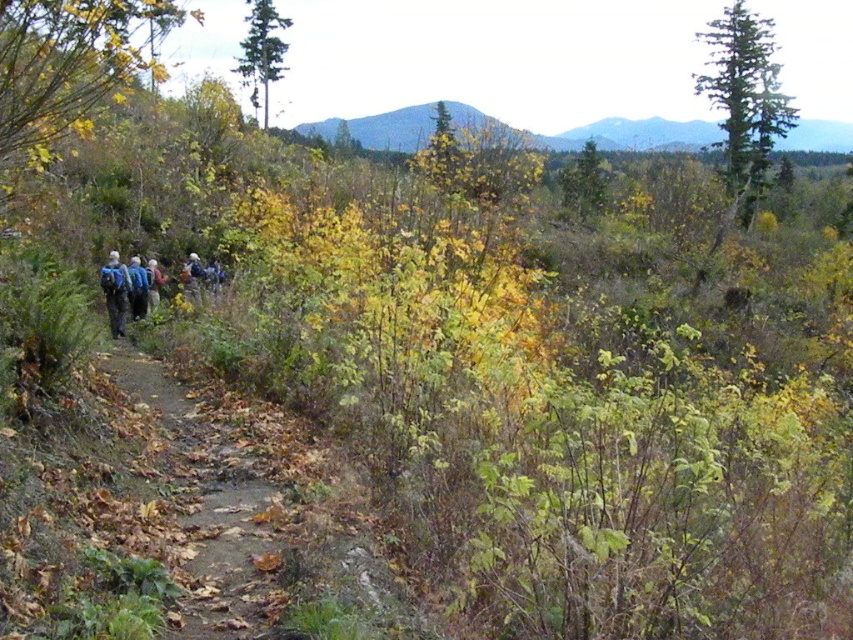
Which is behind, point (405, 125) or point (111, 314)?

The point (405, 125) is behind.

Can you confirm if smooth gray mountain at upper center is positioned below blue backpack at left?

No, smooth gray mountain at upper center is not below blue backpack at left.

The height and width of the screenshot is (640, 853). What do you see at coordinates (635, 134) in the screenshot?
I see `smooth gray mountain at upper center` at bounding box center [635, 134].

This screenshot has height=640, width=853. I want to click on smooth gray mountain at upper center, so click(635, 134).

Looking at this image, which of these two, yellow-green foliage at left or light brown fabric jacket at center, stands taller?

yellow-green foliage at left is taller.

Where is `yellow-green foliage at left`? This screenshot has height=640, width=853. yellow-green foliage at left is located at coordinates (70, 67).

Between green textured tree at upper right and green textured tree at upper center, which one appears on the left side from the viewer's perspective?

green textured tree at upper center

How distant is green textured tree at upper right from green textured tree at upper center?

green textured tree at upper right and green textured tree at upper center are 58.91 meters apart from each other.

Between point (759, 148) and point (248, 97), which one is positioned in front?

Point (759, 148)

The width and height of the screenshot is (853, 640). Identify the location of green textured tree at upper right. (746, 97).